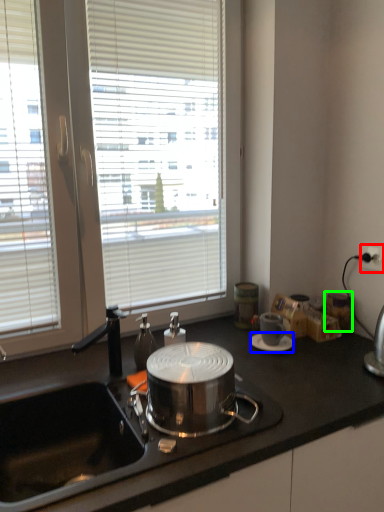
Question: Which is nearer to the power outlet (highlighted by a red box)? saucer (highlighted by a blue box) or appliance (highlighted by a green box).

Choices:
 (A) saucer
 (B) appliance

Answer: (B)